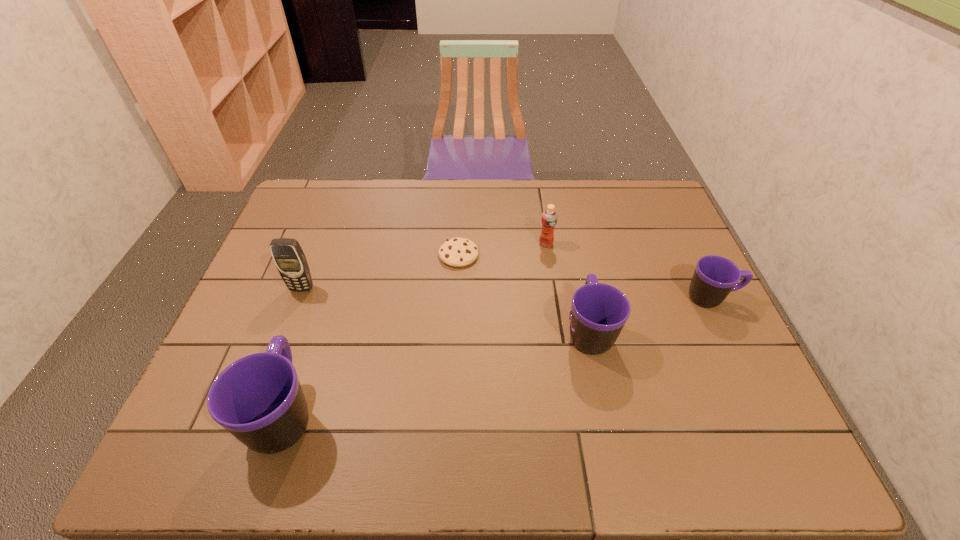
At what (x,y) coordinates should I click in order to perform the action: click on blank region between the orange juice and the shortest object. Please return your answer as a coordinate pair (x, y). This screenshot has width=960, height=540. Looking at the image, I should click on (502, 249).

Locate an element on the screen. This screenshot has height=540, width=960. unoccupied area between the tallest mug and the second tallest mug is located at coordinates (437, 372).

At what (x,y) coordinates should I click in order to perform the action: click on free spot between the cellular telephone and the second shortest mug. Please return your answer as a coordinate pair (x, y). This screenshot has width=960, height=540. Looking at the image, I should click on (445, 309).

The width and height of the screenshot is (960, 540). I want to click on free space between the nearest object and the second tallest mug, so click(x=437, y=372).

Identify the location of free space between the shortest mug and the cellular telephone. This screenshot has height=540, width=960. (507, 293).

Identify the location of unoccupied area between the second mug from right to left and the orange juice. (567, 287).

Locate an element on the screen. free space that is in between the cellular telephone and the second mug from left to right is located at coordinates (445, 309).

Find the location of a particular element. The image size is (960, 540). object that can be found as the third closest to the orange juice is located at coordinates (715, 277).

Where is `object that ranks as the closest to the fourth object from right to left`? The width and height of the screenshot is (960, 540). object that ranks as the closest to the fourth object from right to left is located at coordinates (549, 217).

Image resolution: width=960 pixels, height=540 pixels. I want to click on mug that is the closest to the tallest mug, so click(x=599, y=311).